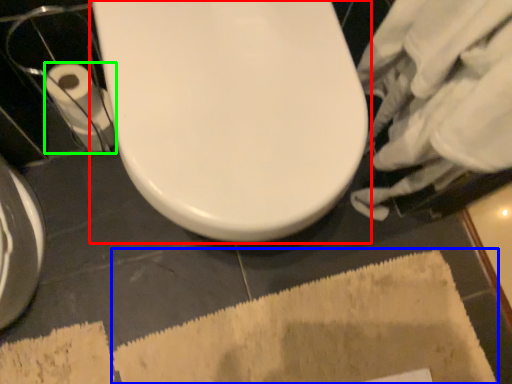
Question: Considering the real-world distances, which object is farthest from toilet (highlighted by a red box)? bath mat (highlighted by a blue box) or toilet paper (highlighted by a green box)?

Choices:
 (A) bath mat
 (B) toilet paper

Answer: (A)